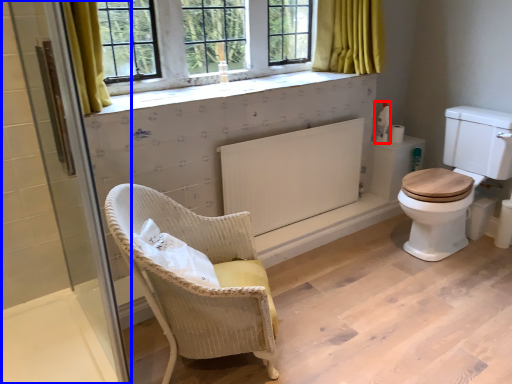
Question: Among these objects, which one is nearest to the camera, toiletries (highlighted by a red box) or screen door (highlighted by a blue box)?

Choices:
 (A) toiletries
 (B) screen door

Answer: (B)